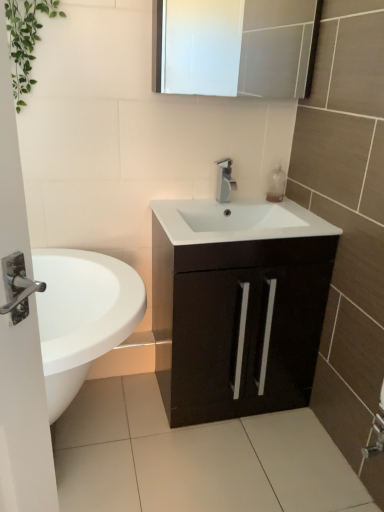
Question: From the image's perspective, is matte black cabinet at center positioned above or below translucent plastic soap dispenser at upper right?

Choices:
 (A) below
 (B) above

Answer: (A)

Question: In terms of width, does matte black cabinet at center look wider or thinner when compared to translucent plastic soap dispenser at upper right?

Choices:
 (A) wide
 (B) thin

Answer: (A)

Question: Estimate the real-world distances between objects in this image. Which object is closer to the green leafy plant at upper left?

Choices:
 (A) white glossy medicine cabinet at upper center
 (B) translucent plastic soap dispenser at upper right
 (C) matte black cabinet at center
 (D) silver metallic faucet at center

Answer: (A)

Question: Estimate the real-world distances between objects in this image. Which object is farther from the translucent plastic soap dispenser at upper right?

Choices:
 (A) green leafy plant at upper left
 (B) white glossy medicine cabinet at upper center
 (C) matte black cabinet at center
 (D) silver metallic faucet at center

Answer: (A)